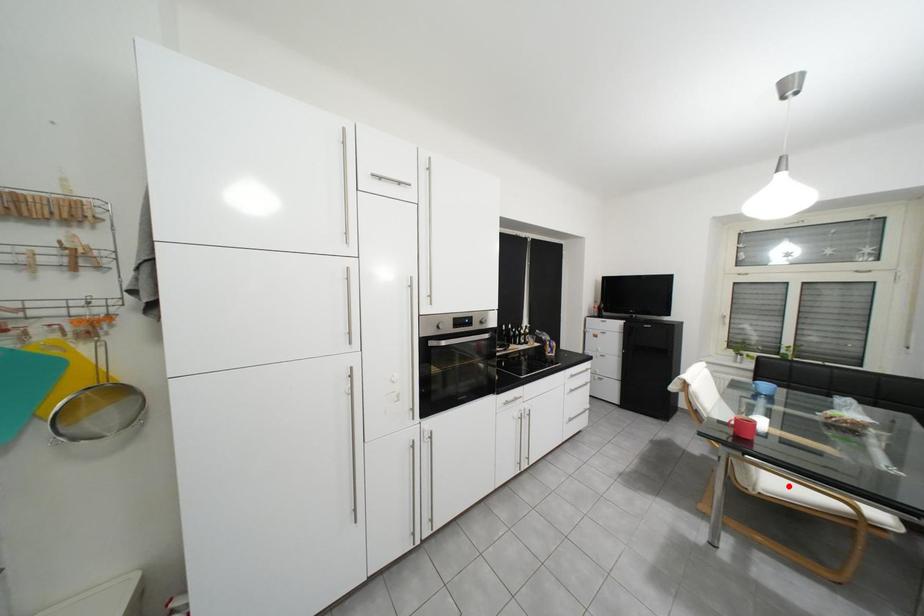
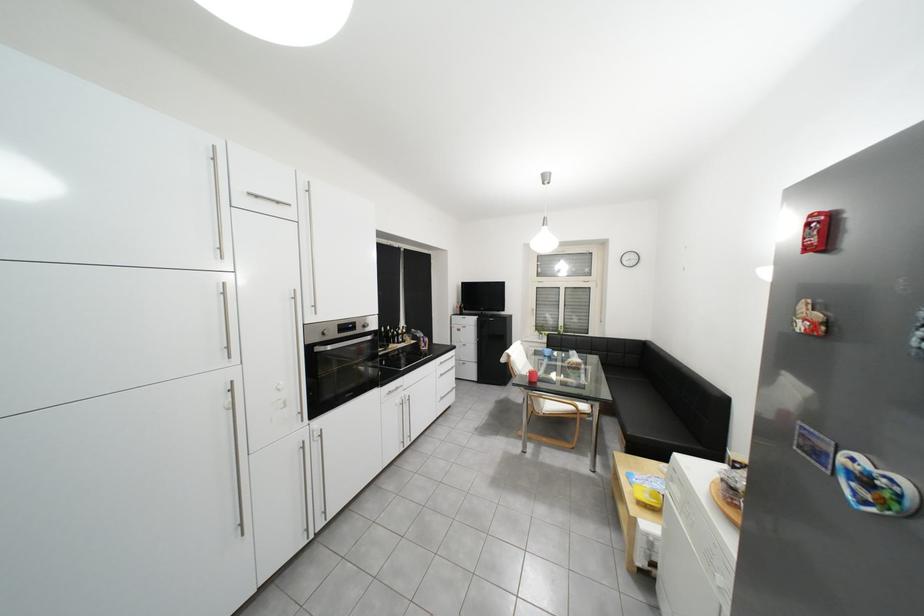
Where in the second image is the point corresponding to the highlighted location from the first image?

(563, 407)